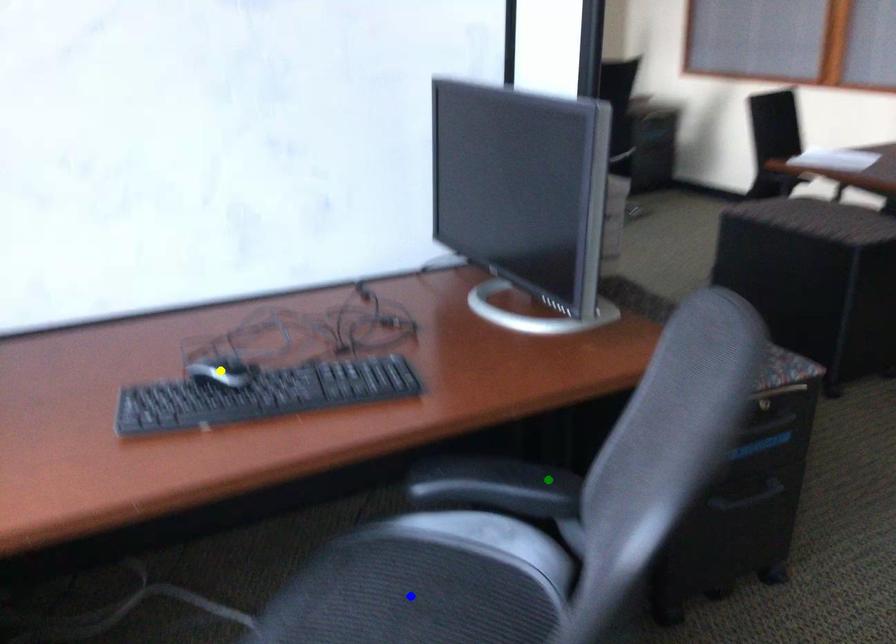
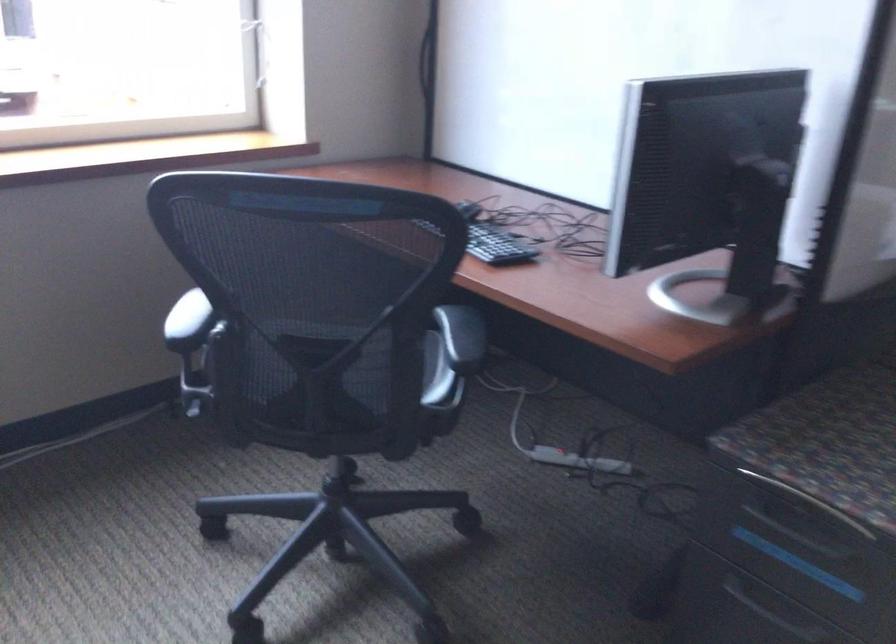
I am providing you with two images of the same scene from different viewpoints. Three points are marked in image1. Which point corresponds to a part or object that is occluded in image2?In image1, three points are marked. Which of them correspond to a part or object that is occluded in image2?Among the three points shown in image1, which one corresponds to a part or object that is no longer visible due to occlusion in image2?

Invisible in image2: blue point, yellow point.